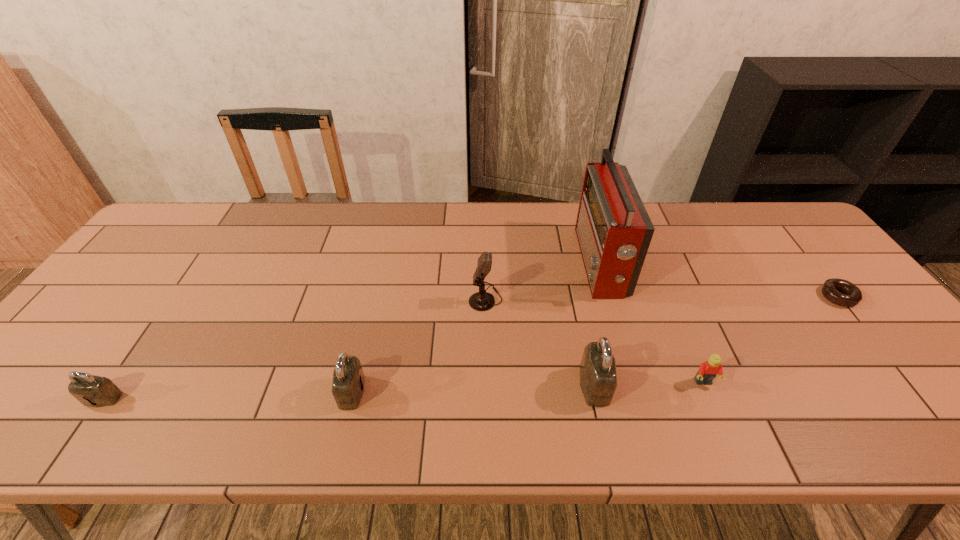
This screenshot has height=540, width=960. What are the coordinates of `doughnut` in the screenshot? It's located at 852,295.

Image resolution: width=960 pixels, height=540 pixels. In order to click on the second object from right to left in this screenshot , I will do `click(708, 370)`.

At what (x,y) coordinates should I click in order to perform the action: click on vacant space situated at the front of the fourth shortest object near the keyhole. Please return your answer as a coordinate pair (x, y). Looking at the image, I should click on (476, 392).

Locate an element on the screen. free location located at the front of the rightmost padlock near the keyhole is located at coordinates (675, 386).

At what (x,y) coordinates should I click in order to perform the action: click on free spot located 0.100m on the front-facing side of the third object from right to left. Please return your answer as a coordinate pair (x, y). Image resolution: width=960 pixels, height=540 pixels. Looking at the image, I should click on (545, 263).

Locate an element on the screen. Image resolution: width=960 pixels, height=540 pixels. vacant space located on the front-facing side of the third object from right to left is located at coordinates (529, 263).

Locate an element on the screen. Image resolution: width=960 pixels, height=540 pixels. vacant region located 0.280m on the front-facing side of the third object from right to left is located at coordinates (484, 263).

You are a GUI agent. You are given a task and a screenshot of the screen. Output one action in this format:
    pyautogui.click(x=<x>, y=<y>)
    Task: Click on the free location located on the front-facing side of the microphone
    This screenshot has width=960, height=540.
    Given the screenshot: What is the action you would take?
    pyautogui.click(x=376, y=299)

Locate an element on the screen. The width and height of the screenshot is (960, 540). free space located 0.380m on the front-facing side of the microphone is located at coordinates (327, 299).

I want to click on vacant area situated on the front-facing side of the microphone, so click(x=395, y=299).